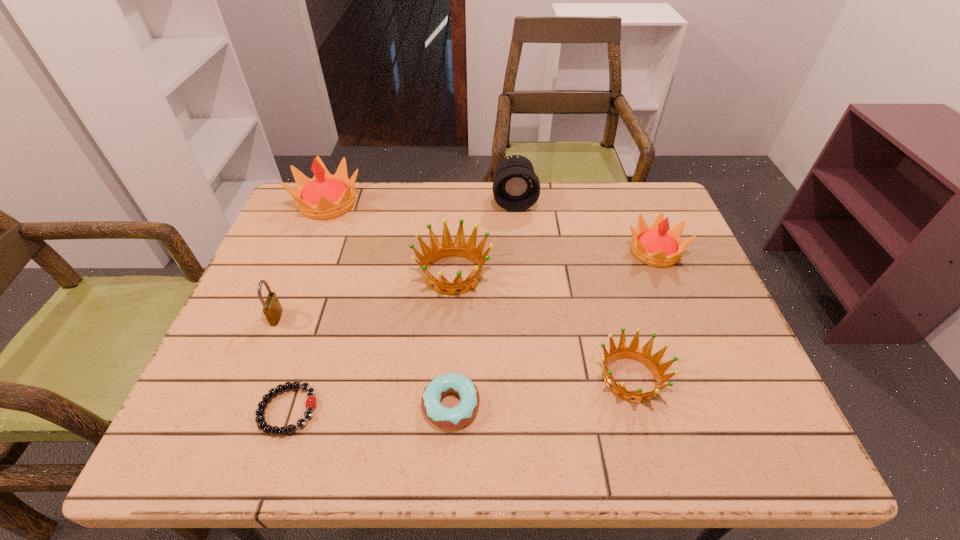
You are a GUI agent. You are given a task and a screenshot of the screen. Output one action in this format:
    pyautogui.click(x=<x>, y=<y>)
    Task: Click on the vacant space located on the back of the third tallest crown
    
    Given the screenshot: What is the action you would take?
    pyautogui.click(x=457, y=209)

Locate an element on the screen. This screenshot has width=960, height=540. vacant space positioned 0.130m on the right of the third crown from left to right is located at coordinates (730, 378).

The width and height of the screenshot is (960, 540). I want to click on blank area located 0.220m on the left of the blue doughnut, so click(x=311, y=405).

Where is `free space located on the left of the black bracelet`? The image size is (960, 540). free space located on the left of the black bracelet is located at coordinates (218, 410).

I want to click on crown that is at the far edge, so click(x=325, y=196).

At what (x,y) coordinates should I click in order to perform the action: click on telephoto lens that is at the far edge. Please return your answer as a coordinate pair (x, y). The image size is (960, 540). Looking at the image, I should click on (516, 187).

Identify the location of doughnut present at the near edge. (447, 418).

This screenshot has height=540, width=960. Identify the location of bracelet situated at the near edge. (311, 402).

Find the location of `crown positioned at the left edge`. crown positioned at the left edge is located at coordinates (325, 196).

Where is `padlock that is at the left edge`? This screenshot has width=960, height=540. padlock that is at the left edge is located at coordinates (272, 309).